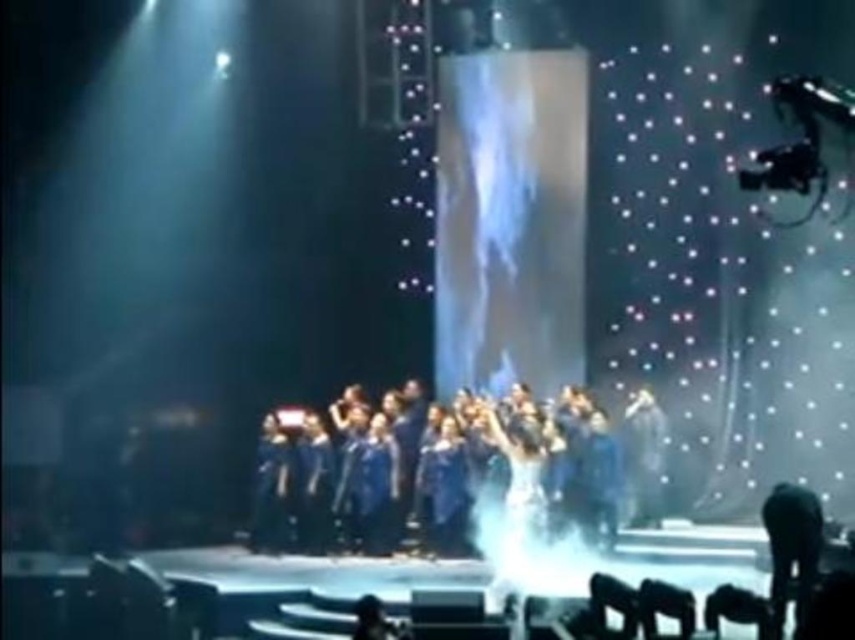
Question: Which point appears farthest from the camera in this image?

Choices:
 (A) (783, 618)
 (B) (343, 484)

Answer: (B)

Question: Can you confirm if blue fabric group at center is smaller than shiny silver dress at center?

Choices:
 (A) no
 (B) yes

Answer: (B)

Question: Which of the following is the closest to the observer?

Choices:
 (A) shiny silver dress at center
 (B) blue fabric group at center
 (C) black fabric microphone at lower right

Answer: (C)

Question: Which point appears closest to the camera in this image?

Choices:
 (A) (626, 424)
 (B) (564, 426)
 (C) (800, 509)

Answer: (C)

Question: Does blue fabric group at center come in front of shiny silver dress at center?

Choices:
 (A) yes
 (B) no

Answer: (A)

Question: Is blue fabric group at center to the left of shiny silver dress at center from the viewer's perspective?

Choices:
 (A) no
 (B) yes

Answer: (B)